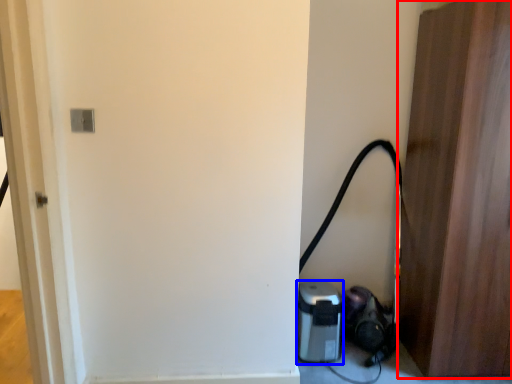
Question: Among these objects, which one is nearest to the camera, door (highlighted by a red box) or appliance (highlighted by a blue box)?

Choices:
 (A) door
 (B) appliance

Answer: (A)